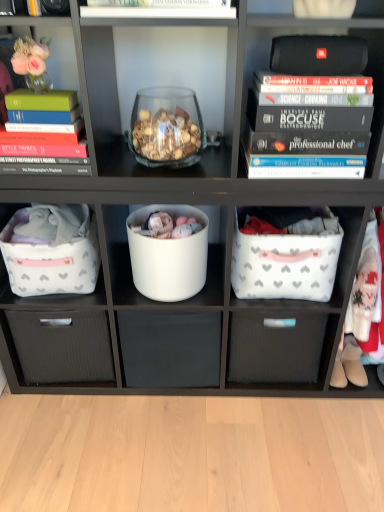
This screenshot has height=512, width=384. Find the location of `free space in front of white matte drawer at center, the first drawer when ordered from left to right`. free space in front of white matte drawer at center, the first drawer when ordered from left to right is located at coordinates (148, 418).